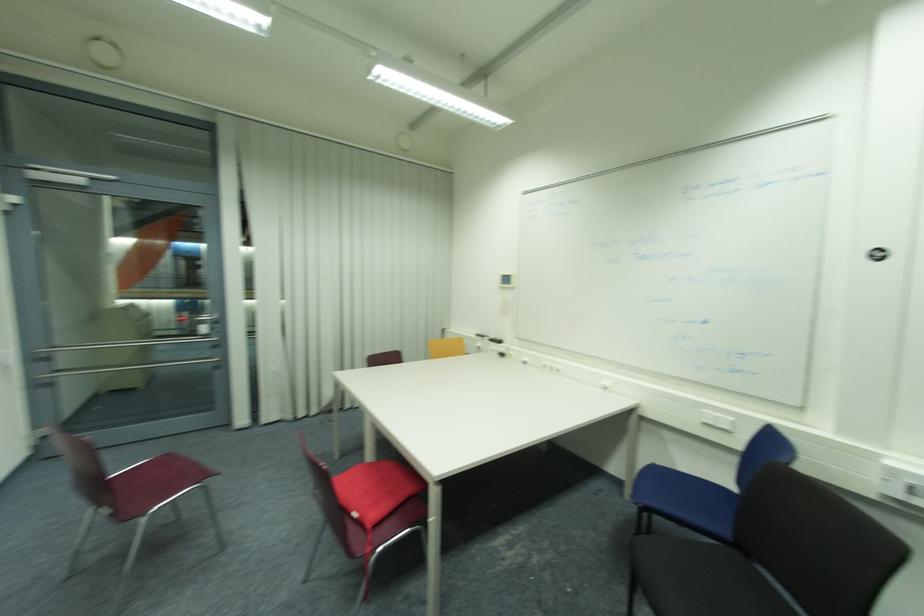
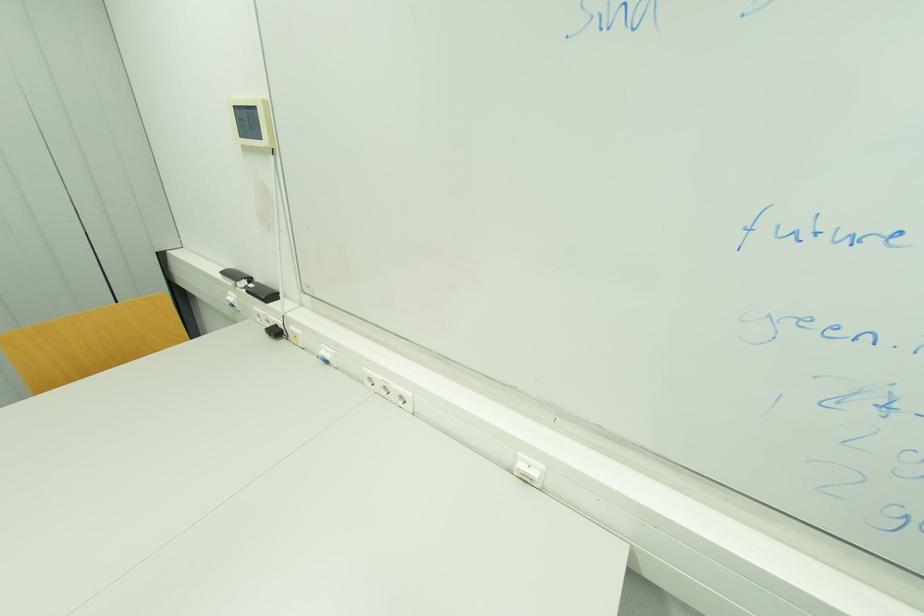
In the second image, find the point that corresponds to [506,355] in the first image.

(281, 333)